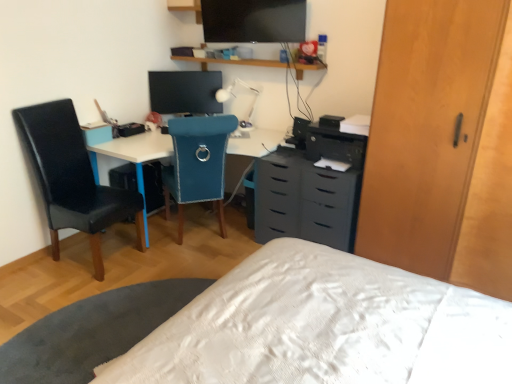
I want to click on vacant space that's between black leather chair at left, placed as the second chair when sorted from right to left, and white plastic desk at center, so click(x=151, y=273).